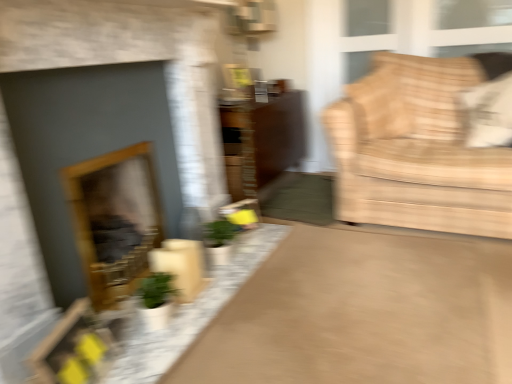
The width and height of the screenshot is (512, 384). What do you see at coordinates (239, 75) in the screenshot?
I see `metallic silver picture frame at upper center` at bounding box center [239, 75].

What do you see at coordinates (115, 220) in the screenshot? I see `wooden frame fireplace at left, positioned as the first fireplace in back-to-front order` at bounding box center [115, 220].

Describe the element at coordinates (84, 144) in the screenshot. I see `matte gray fireplace at left, the first fireplace from the front` at that location.

In order to click on matte brown dresser at center in this screenshot , I will do [262, 141].

This screenshot has width=512, height=384. Identify the location of white fabric pillow at upper right. (489, 113).

Is metallic silver picture frame at upper center positioned with its back to matte gray fireplace at left, the first fireplace from the front?

No.

Does metallic silver picture frame at upper center appear on the right side of matte gray fireplace at left, the first fireplace from the front?

Indeed, metallic silver picture frame at upper center is positioned on the right side of matte gray fireplace at left, the first fireplace from the front.

Is the position of metallic silver picture frame at upper center more distant than that of matte gray fireplace at left, the first fireplace from the front?

Yes, metallic silver picture frame at upper center is behind matte gray fireplace at left, the first fireplace from the front.

Who is more distant, matte brown rug at center or beige fabric couch at right?

beige fabric couch at right is further from the camera.

What's the angular difference between matte brown rug at center and beige fabric couch at right's facing directions?

The angle between the facing direction of matte brown rug at center and the facing direction of beige fabric couch at right is 0.111 degrees.

Is matte brown rug at center far away from beige fabric couch at right?

No, matte brown rug at center is in close proximity to beige fabric couch at right.

From a real-world perspective, relative to beige fabric couch at right, is matte brown rug at center vertically above or below?

From a real-world perspective, matte brown rug at center is physically below beige fabric couch at right.

Considering the sizes of matte gray fireplace at left, marked as the 2th fireplace in a back-to-front arrangement, and matte brown rug at center in the image, is matte gray fireplace at left, marked as the 2th fireplace in a back-to-front arrangement, bigger or smaller than matte brown rug at center?

Clearly, matte gray fireplace at left, marked as the 2th fireplace in a back-to-front arrangement, is larger in size than matte brown rug at center.

Who is more distant, matte gray fireplace at left, marked as the 2th fireplace in a back-to-front arrangement, or matte brown rug at center?

matte gray fireplace at left, marked as the 2th fireplace in a back-to-front arrangement, is more distant.

Is matte gray fireplace at left, the first fireplace from the front, turned away from matte brown rug at center?

No.

At what (x,y) coordinates should I click in order to perform the action: click on fireplace that is the 2nd one above the matte brown rug at center (from a real-world perspective). Please return your answer as a coordinate pair (x, y). Looking at the image, I should click on (84, 144).

What's the angular difference between wooden frame fireplace at left, which ranks as the 2th fireplace in front-to-back order, and beige fabric couch at right's facing directions?

There is a 90.2-degree angle between the facing directions of wooden frame fireplace at left, which ranks as the 2th fireplace in front-to-back order, and beige fabric couch at right.

Considering the relative sizes of wooden frame fireplace at left, positioned as the first fireplace in back-to-front order, and beige fabric couch at right in the image provided, is wooden frame fireplace at left, positioned as the first fireplace in back-to-front order, bigger than beige fabric couch at right?

No, wooden frame fireplace at left, positioned as the first fireplace in back-to-front order, is not bigger than beige fabric couch at right.

Is wooden frame fireplace at left, positioned as the first fireplace in back-to-front order, facing away from beige fabric couch at right?

That's not correct — wooden frame fireplace at left, positioned as the first fireplace in back-to-front order, is not looking away from beige fabric couch at right.

Starting from the matte brown rug at center, which fireplace is the 2nd one behind? Please provide its 2D coordinates.

[(115, 220)]

Which is in front, point (444, 324) or point (86, 217)?

Point (444, 324)

Does matte brown rug at center have a greater width compared to wooden frame fireplace at left, which ranks as the 2th fireplace in front-to-back order?

Correct, the width of matte brown rug at center exceeds that of wooden frame fireplace at left, which ranks as the 2th fireplace in front-to-back order.

Can you tell me how much matte brown rug at center and wooden frame fireplace at left, positioned as the first fireplace in back-to-front order, differ in facing direction?

There is a 90.4-degree angle between the facing directions of matte brown rug at center and wooden frame fireplace at left, positioned as the first fireplace in back-to-front order.

Can you confirm if metallic silver picture frame at upper center is smaller than white fabric pillow at upper right?

Yes, metallic silver picture frame at upper center is smaller than white fabric pillow at upper right.

You are a GUI agent. You are given a task and a screenshot of the screen. Output one action in this format:
    pyautogui.click(x=<x>, y=<y>)
    Task: Click on the picture frame behind the white fabric pillow at upper right
    The image size is (512, 384).
    Given the screenshot: What is the action you would take?
    pyautogui.click(x=239, y=75)

Is metallic silver picture frame at upper center further to the viewer compared to white fabric pillow at upper right?

Yes, metallic silver picture frame at upper center is further from the camera.

Is point (229, 84) closer or farther from the camera than point (490, 134)?

Clearly, point (229, 84) is more distant from the camera than point (490, 134).

Could you tell me if beige fabric couch at right is turned towards white fabric pillow at upper right?

Yes, beige fabric couch at right is oriented towards white fabric pillow at upper right.

In terms of width, does beige fabric couch at right look wider or thinner when compared to white fabric pillow at upper right?

Clearly, beige fabric couch at right has more width compared to white fabric pillow at upper right.

Is beige fabric couch at right smaller than white fabric pillow at upper right?

Actually, beige fabric couch at right might be larger than white fabric pillow at upper right.

From a real-world perspective, which object rests below the other?

From a 3D spatial view, beige fabric couch at right is below.

There is a metallic silver picture frame at upper center. Identify the location of the 1st fireplace below it (from the image's perspective). This screenshot has height=384, width=512. (84, 144).

The height and width of the screenshot is (384, 512). In order to click on plain in front of the beige fabric couch at right in this screenshot , I will do `click(362, 314)`.

Based on their spatial positions, is matte brown rug at center or matte brown dresser at center closer to wooden frame fireplace at left, positioned as the first fireplace in back-to-front order?

Based on the image, matte brown rug at center appears to be nearer to wooden frame fireplace at left, positioned as the first fireplace in back-to-front order.

Considering their positions, is matte brown dresser at center positioned further to matte brown rug at center than matte gray fireplace at left, marked as the 2th fireplace in a back-to-front arrangement?

The object further to matte brown rug at center is matte brown dresser at center.

Which object lies further to the anchor point wooden frame fireplace at left, which ranks as the 2th fireplace in front-to-back order, matte brown rug at center or metallic silver picture frame at upper center?

metallic silver picture frame at upper center.

From the image, which object appears to be farther from white fabric pillow at upper right, wooden frame fireplace at left, positioned as the first fireplace in back-to-front order, or beige fabric couch at right?

Based on the image, wooden frame fireplace at left, positioned as the first fireplace in back-to-front order, appears to be further to white fabric pillow at upper right.

Based on their spatial positions, is matte brown dresser at center or wooden frame fireplace at left, which ranks as the 2th fireplace in front-to-back order, further from beige fabric couch at right?

wooden frame fireplace at left, which ranks as the 2th fireplace in front-to-back order.

Considering their positions, is wooden frame fireplace at left, positioned as the first fireplace in back-to-front order, positioned further to beige fabric couch at right than white fabric pillow at upper right?

wooden frame fireplace at left, positioned as the first fireplace in back-to-front order, is further to beige fabric couch at right.

Which object lies further to the anchor point wooden frame fireplace at left, positioned as the first fireplace in back-to-front order, matte brown dresser at center or white fabric pillow at upper right?

white fabric pillow at upper right is positioned further to the anchor wooden frame fireplace at left, positioned as the first fireplace in back-to-front order.

From the image, which object appears to be farther from matte gray fireplace at left, the first fireplace from the front, wooden frame fireplace at left, positioned as the first fireplace in back-to-front order, or matte brown dresser at center?

The object further to matte gray fireplace at left, the first fireplace from the front, is matte brown dresser at center.

Find the location of a particular element. The width and height of the screenshot is (512, 384). furniture between matte gray fireplace at left, marked as the 2th fireplace in a back-to-front arrangement, and matte brown dresser at center from front to back is located at coordinates (417, 151).

Where is `furniture between matte brown dresser at center and white fabric pillow at upper right from left to right`? The width and height of the screenshot is (512, 384). furniture between matte brown dresser at center and white fabric pillow at upper right from left to right is located at coordinates (417, 151).

The height and width of the screenshot is (384, 512). Find the location of `dresser between metallic silver picture frame at upper center and beige fabric couch at right`. dresser between metallic silver picture frame at upper center and beige fabric couch at right is located at coordinates (262, 141).

Image resolution: width=512 pixels, height=384 pixels. What are the coordinates of `dresser positioned between matte brown rug at center and metallic silver picture frame at upper center from near to far` in the screenshot? It's located at (262, 141).